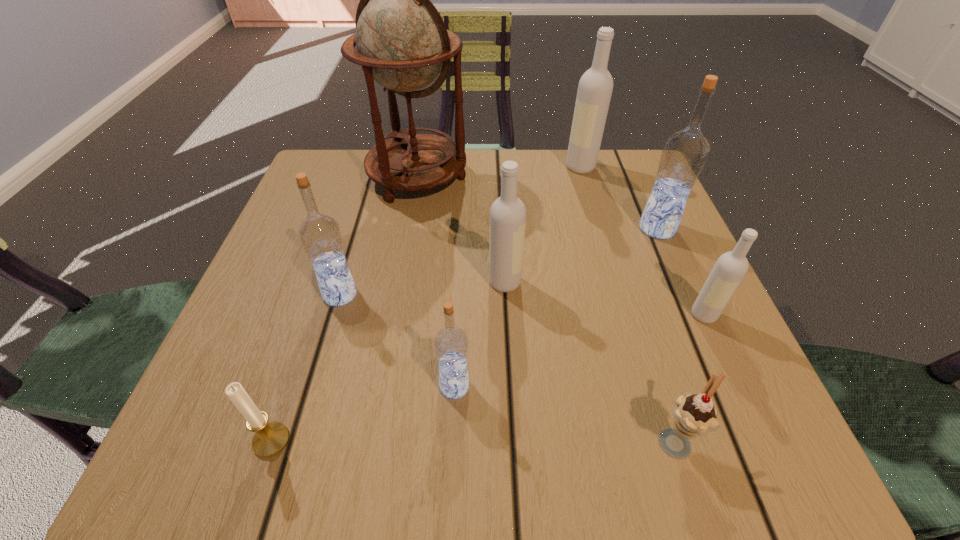
Identify the location of globe. This screenshot has width=960, height=540. (402, 43).

The width and height of the screenshot is (960, 540). I want to click on the farthest white vodka, so click(x=595, y=87).

Locate an element on the screen. This screenshot has height=540, width=960. the second white vodka from left to right is located at coordinates (595, 87).

At what (x,y) coordinates should I click in order to perform the action: click on the biggest blue vodka. Please return your answer as a coordinate pair (x, y). The image size is (960, 540). Looking at the image, I should click on (684, 153).

Locate an element on the screen. This screenshot has width=960, height=540. the farthest blue vodka is located at coordinates (684, 153).

Identify the location of the leftmost vodka. (320, 235).

This screenshot has width=960, height=540. I want to click on the second biggest blue vodka, so click(x=320, y=235).

Image resolution: width=960 pixels, height=540 pixels. In order to click on the second biggest white vodka in this screenshot , I will do `click(507, 224)`.

This screenshot has width=960, height=540. Find the location of `the third vodka from left to right`. the third vodka from left to right is located at coordinates (507, 224).

You are a GUI agent. You are given a task and a screenshot of the screen. Output one action in this format:
    pyautogui.click(x=<x>, y=<y>)
    Task: Click on the rightmost white vodka
    This screenshot has height=540, width=960.
    Given the screenshot: What is the action you would take?
    pyautogui.click(x=730, y=268)